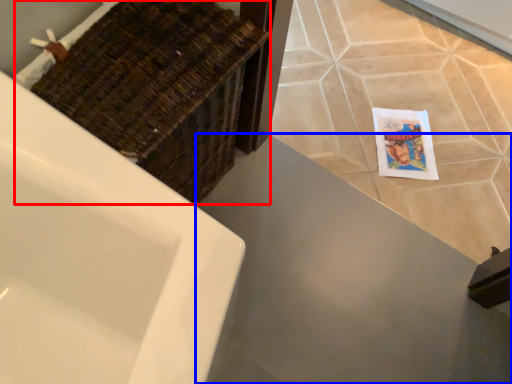
Question: Which of the following is the farthest to the observer, basket (highlighted by a red box) or counter top (highlighted by a blue box)?

Choices:
 (A) basket
 (B) counter top

Answer: (B)